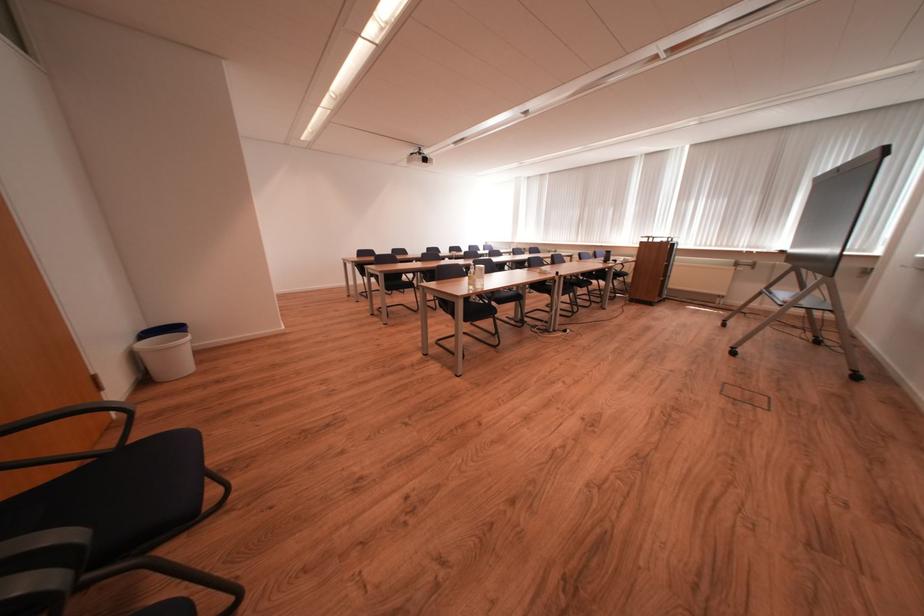
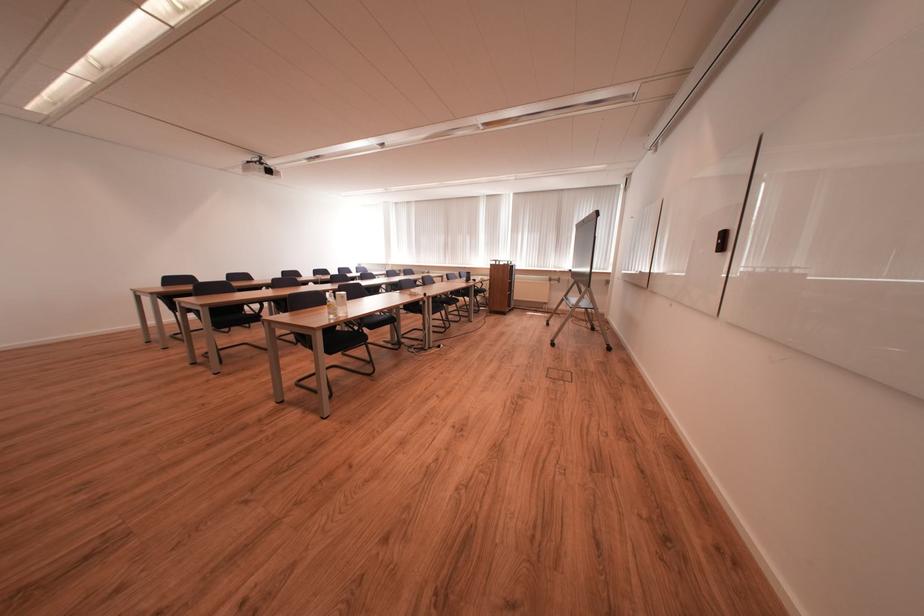
The point at (653, 241) is marked in the first image. Where is the corresponding point in the second image?

(503, 265)